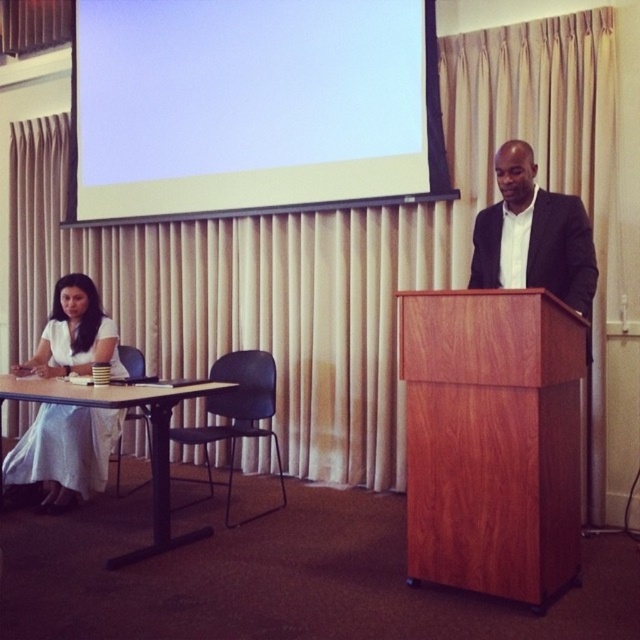
Question: Which point is farther to the camera?

Choices:
 (A) (570, 260)
 (B) (417, 349)
 (C) (129, 556)
 (D) (368, 202)

Answer: (D)

Question: Considering the relative positions of wooden table at lower left and white matte projection screen at upper center in the image provided, where is wooden table at lower left located with respect to white matte projection screen at upper center?

Choices:
 (A) right
 (B) left

Answer: (B)

Question: Based on their relative distances, which object is farther from the white cotton dress at lower left?

Choices:
 (A) wooden table at lower left
 (B) cherry wood podium at center
 (C) white matte projection screen at upper center

Answer: (B)

Question: Is cherry wood podium at center positioned behind white matte projection screen at upper center?

Choices:
 (A) no
 (B) yes

Answer: (A)

Question: Does cherry wood podium at center appear under white matte projection screen at upper center?

Choices:
 (A) yes
 (B) no

Answer: (A)

Question: Which of the following is the farthest from the observer?

Choices:
 (A) cherry wood podium at center
 (B) matte black suit at center

Answer: (B)